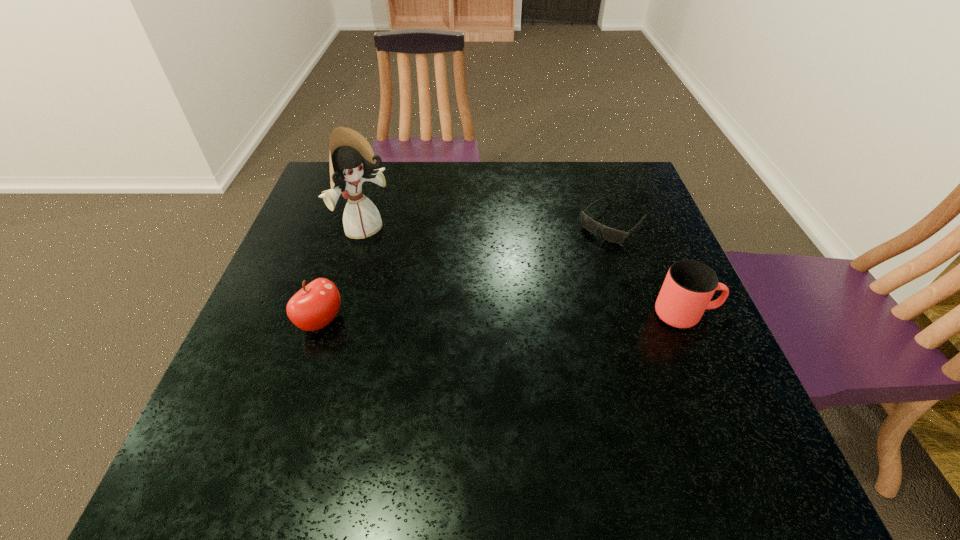
Image resolution: width=960 pixels, height=540 pixels. I want to click on vacant position in the image that satisfies the following two spatial constraints: 1. on the back side of the cup; 2. on the handle side of the apple, so click(x=324, y=314).